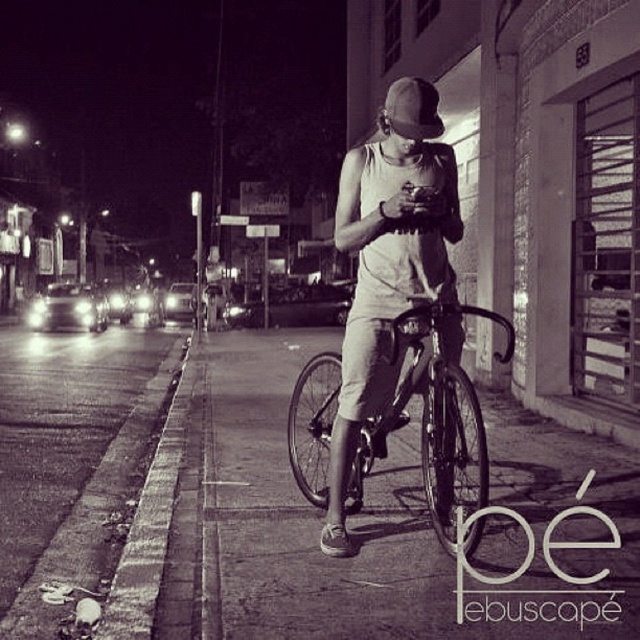
Question: Which point is closer to the camera taking this photo?

Choices:
 (A) (307, 376)
 (B) (387, 115)

Answer: (B)

Question: Is matte white tank top at center closer to the viewer compared to metallic silver bicycle at center?

Choices:
 (A) no
 (B) yes

Answer: (A)

Question: Among these objects, which one is farthest from the camera?

Choices:
 (A) matte white tank top at center
 (B) metallic silver bicycle at center

Answer: (A)

Question: Can you confirm if matte white tank top at center is positioned to the right of matte black baseball hat at center?

Choices:
 (A) no
 (B) yes

Answer: (A)

Question: Which object is positioned farthest from the matte white tank top at center?

Choices:
 (A) metallic silver bicycle at center
 (B) matte black baseball hat at center

Answer: (B)

Question: Is matte white tank top at center thinner than matte black baseball hat at center?

Choices:
 (A) no
 (B) yes

Answer: (B)